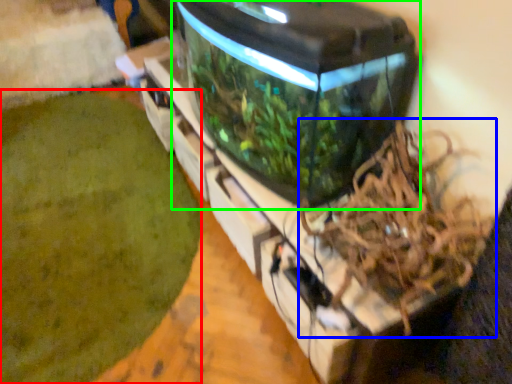
Question: Based on their relative distances, which object is farther from debris (highlighted by a red box)? Choose from bird nest (highlighted by a blue box) and water tank (highlighted by a green box).

Choices:
 (A) bird nest
 (B) water tank

Answer: (A)